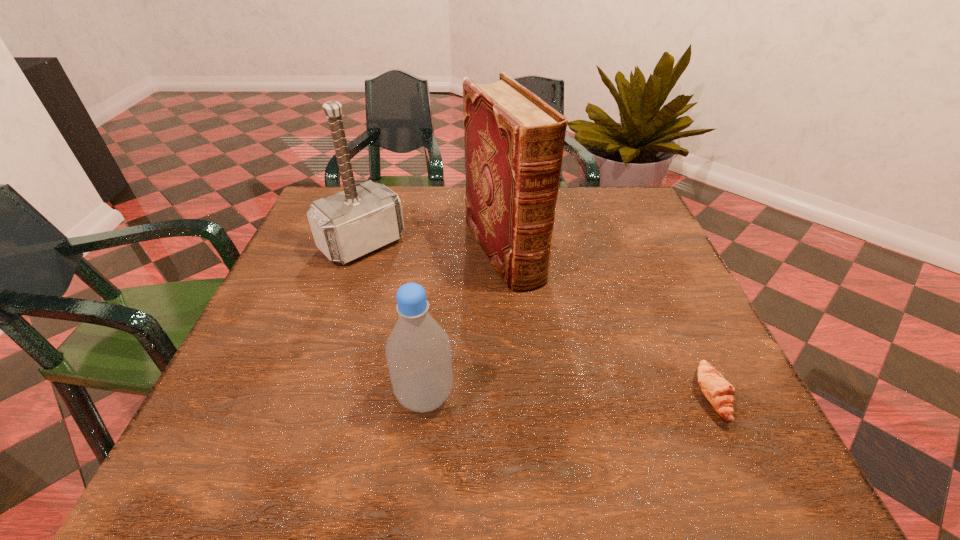
Identify the location of the second shortest object. (418, 351).

The width and height of the screenshot is (960, 540). In order to click on bottle in this screenshot , I will do `click(418, 351)`.

Locate an element on the screen. This screenshot has width=960, height=540. the rightmost object is located at coordinates pos(719,392).

This screenshot has width=960, height=540. In order to click on pastry in this screenshot , I will do `click(719, 392)`.

Image resolution: width=960 pixels, height=540 pixels. Find the location of `the leftmost object`. the leftmost object is located at coordinates (345, 226).

Identify the location of hardback book. (514, 141).

The image size is (960, 540). What are the coordinates of `vacant space located 0.330m on the back of the bottle` in the screenshot? It's located at (440, 260).

Locate an element on the screen. blank space located for striking with the head of the leftmost object is located at coordinates (491, 357).

The width and height of the screenshot is (960, 540). Identify the location of free space located for striking with the head of the leftmost object. (403, 279).

You are a GUI agent. You are given a task and a screenshot of the screen. Output one action in this format:
    pyautogui.click(x=<x>, y=<y>)
    Task: Click on the vacant space located 0.060m for striking with the head of the leftmost object
    
    Given the screenshot: What is the action you would take?
    pyautogui.click(x=398, y=275)